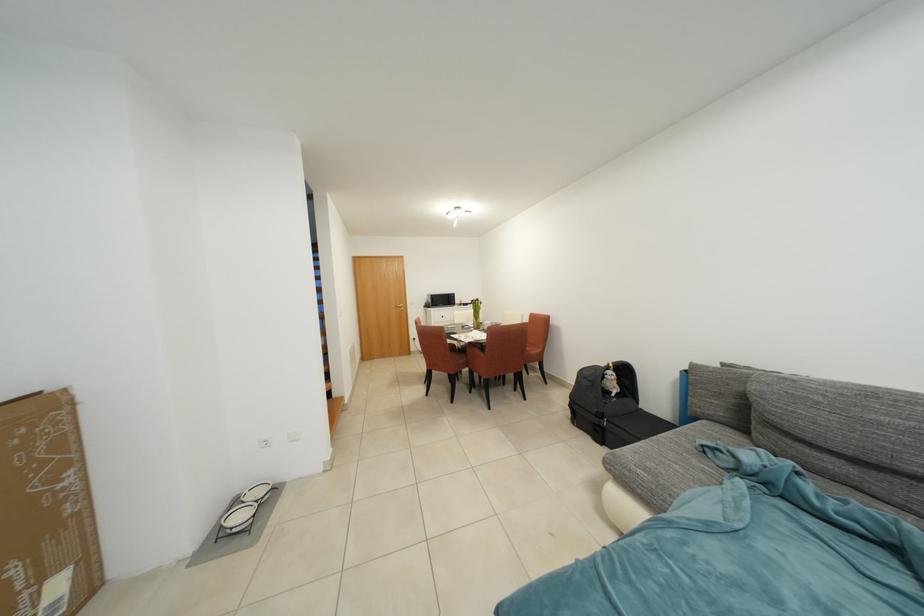
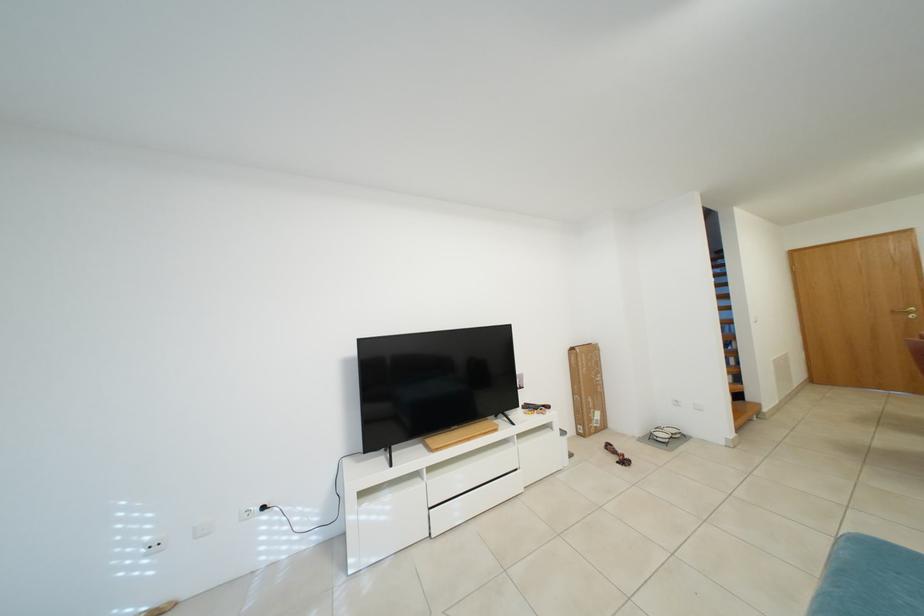
Find the pixel in the second image that matches (245,507) in the first image.

(666, 432)